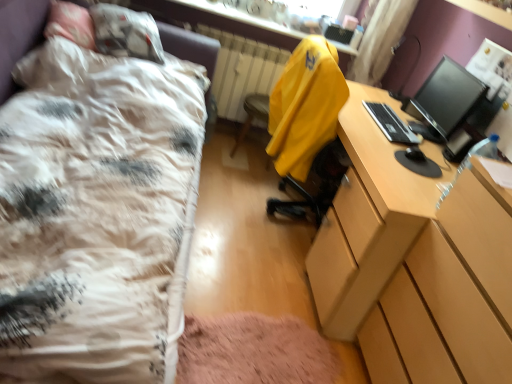
Question: Is yellow fabric computer chair at center completely or partially outside of black plastic keyboard at right?

Choices:
 (A) no
 (B) yes

Answer: (B)

Question: Is yellow fabric computer chair at center wider than black plastic keyboard at right?

Choices:
 (A) yes
 (B) no

Answer: (A)

Question: From the image's perspective, is yellow fabric computer chair at center beneath black plastic keyboard at right?

Choices:
 (A) no
 (B) yes

Answer: (A)

Question: From the image's perspective, is yellow fabric computer chair at center above black plastic keyboard at right?

Choices:
 (A) no
 (B) yes

Answer: (B)

Question: Considering the relative sizes of yellow fabric computer chair at center and black plastic keyboard at right in the image provided, is yellow fabric computer chair at center taller than black plastic keyboard at right?

Choices:
 (A) yes
 (B) no

Answer: (A)

Question: Does yellow fabric computer chair at center have a smaller size compared to black plastic keyboard at right?

Choices:
 (A) yes
 (B) no

Answer: (B)

Question: Considering the relative sizes of black plastic keyboard at right and wooden desk at right in the image provided, is black plastic keyboard at right bigger than wooden desk at right?

Choices:
 (A) yes
 (B) no

Answer: (B)

Question: Is black plastic keyboard at right touching wooden desk at right?

Choices:
 (A) yes
 (B) no

Answer: (B)

Question: Is black plastic keyboard at right not close to wooden desk at right?

Choices:
 (A) yes
 (B) no

Answer: (B)

Question: From a real-world perspective, is black plastic keyboard at right located beneath wooden desk at right?

Choices:
 (A) no
 (B) yes

Answer: (A)

Question: Is black plastic keyboard at right not within wooden desk at right?

Choices:
 (A) no
 (B) yes

Answer: (B)

Question: From the image's perspective, would you say black plastic keyboard at right is positioned over wooden desk at right?

Choices:
 (A) no
 (B) yes

Answer: (B)

Question: Is yellow fabric computer chair at center completely or partially outside of yellow fabric jacket at center?

Choices:
 (A) yes
 (B) no

Answer: (A)